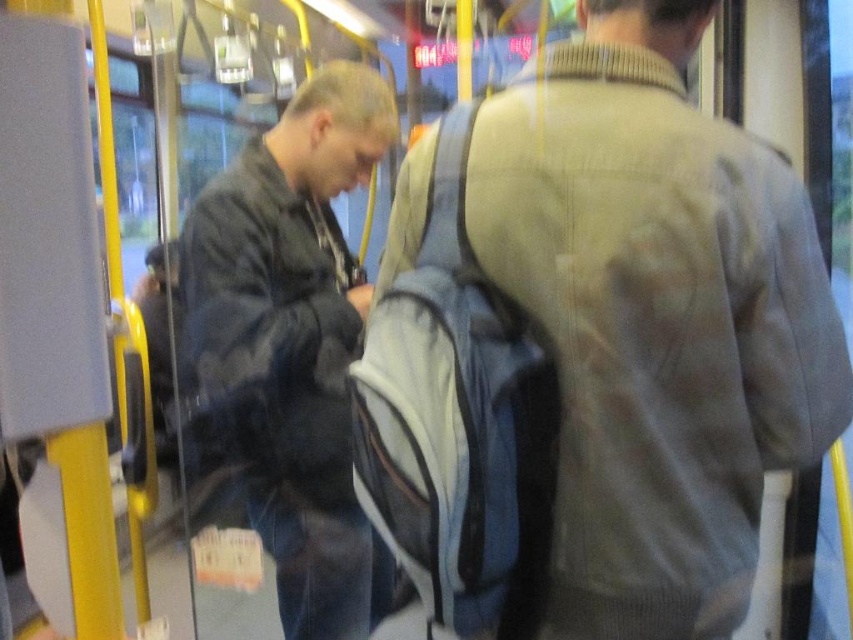
You are a passenger on a bus and see the black matte jacket at left and the gray wool sweater at center. Which person is standing closer to the left side of the bus?

The black matte jacket at left is to the left of gray wool sweater at center, so the person wearing the black matte jacket at left is standing closer to the left side of the bus.

You are a delivery robot with a 30 inch wide package. You need to navigate between the black matte jacket at left and the gray wool sweater at center in the public transportation vehicle. Will there be enough space for you to pass through?

The black matte jacket at left and gray wool sweater at center are 26.34 inches apart from each other. Since the package is 30 inches wide, which is wider than the available space, the delivery robot cannot pass through the gap between them.

You are a passenger on a bus and you see two people wearing the black matte jacket at left and the gray wool sweater at center. If you need to move past them to exit the bus, which clothing item would you have to maneuver around more due to its size?

The black matte jacket at left is larger in size than the gray wool sweater at center, so you would need to maneuver around the black matte jacket at left more because of its size.